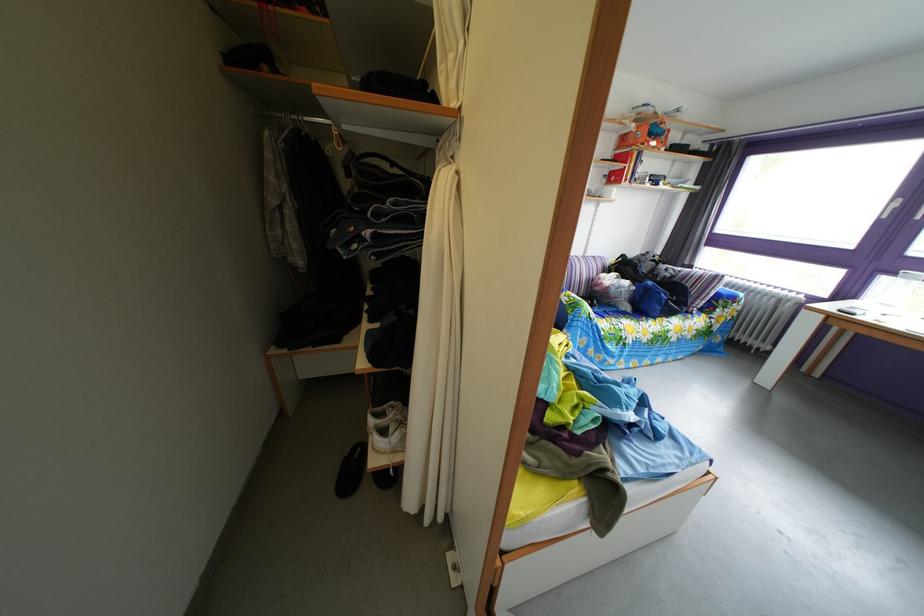
The image size is (924, 616). I want to click on white window handle, so click(891, 207).